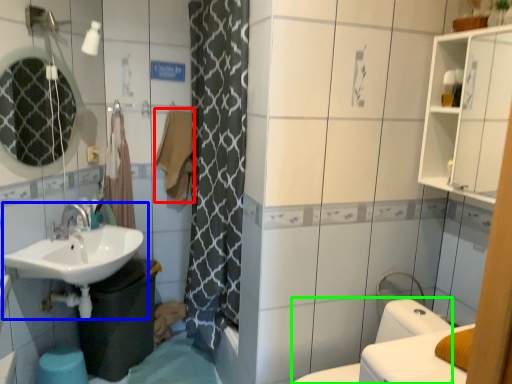
Question: Based on their relative distances, which object is nearer to bath towel (highlighted by a red box)? Choose from sink (highlighted by a blue box) and bidet (highlighted by a green box).

Choices:
 (A) sink
 (B) bidet

Answer: (A)